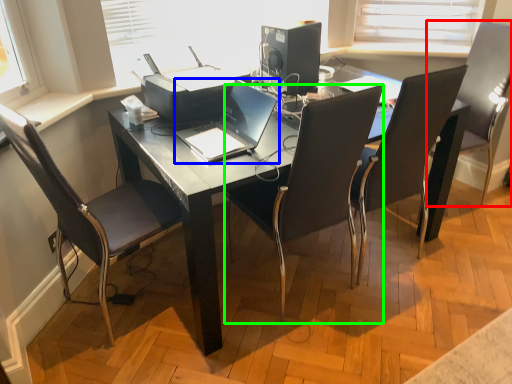
Question: Estimate the real-world distances between objects in this image. Which object is farther from chair (highlighted by a red box), laptop (highlighted by a blue box) or chair (highlighted by a green box)?

Choices:
 (A) laptop
 (B) chair

Answer: (A)